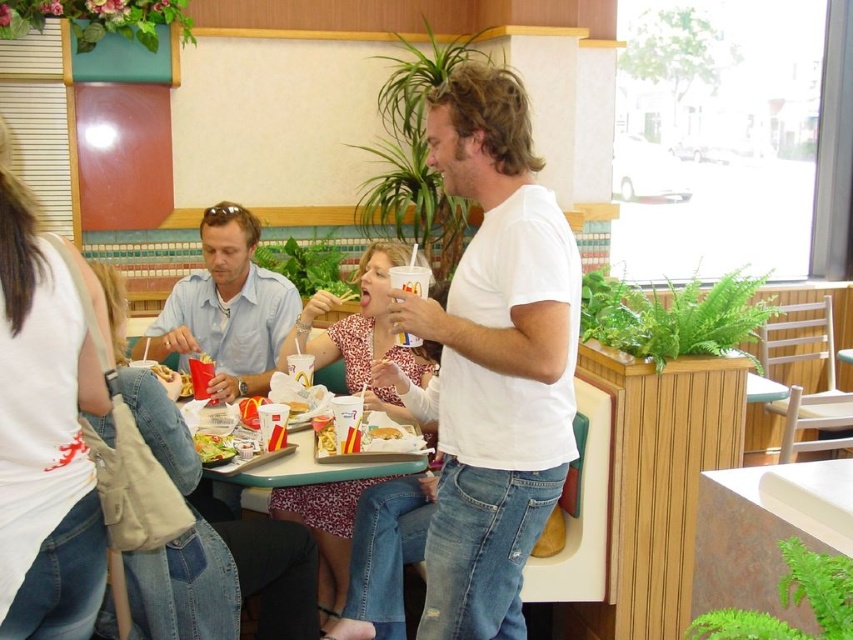
You are a customer at this McDonalds booth and you want to place your fries on the plastic tray at center so you can reach your drink in the yellow paper cup at center. Can you easily access both items without moving anything?

The plastic tray at center is positioned on the left side of yellow paper cup at center, so you can easily reach both items without moving anything since they are placed next to each other.

You are a customer at this McDonalds booth. You want to place your burger on the table. Where should you put it to ensure it is on the plastic tray at center?

You should place your burger on the plastic tray at center located at point (x=218, y=506) to ensure it is on the correct spot.